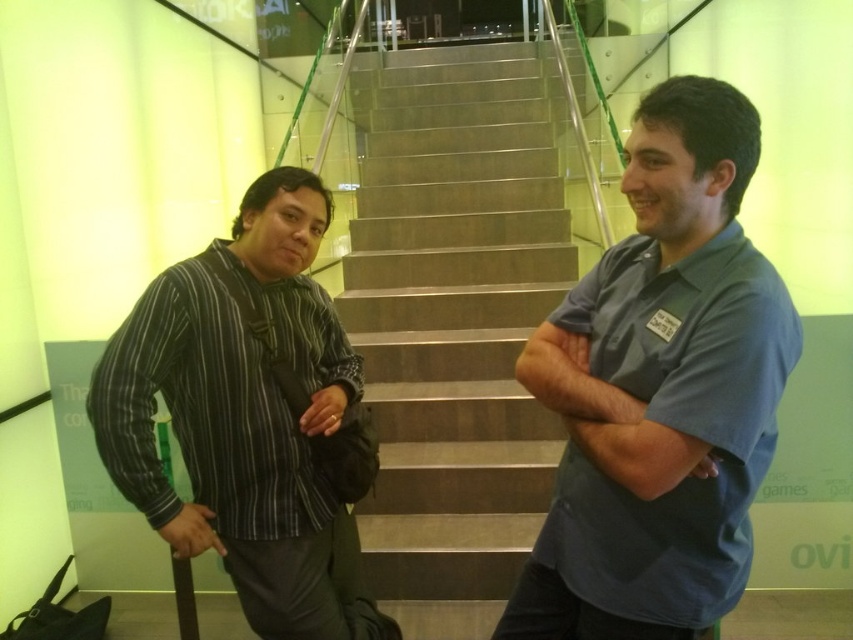
Is blue fabric shirt at center below striped cotton shirt at left?

No.

Is blue fabric shirt at center positioned at the back of striped cotton shirt at left?

No.

Where is `blue fabric shirt at center`? blue fabric shirt at center is located at coordinates (660, 390).

Image resolution: width=853 pixels, height=640 pixels. What are the coordinates of `blue fabric shirt at center` in the screenshot? It's located at (660, 390).

Can you confirm if blue fabric shirt at center is positioned above metallic staircase at center?

Answer: No, blue fabric shirt at center is not above metallic staircase at center.

Is point (695, 627) positioned before point (395, 420)?

That is True.

Describe the element at coordinates (660, 390) in the screenshot. I see `blue fabric shirt at center` at that location.

At what (x,y) coordinates should I click in order to perform the action: click on blue fabric shirt at center. Please return your answer as a coordinate pair (x, y). The image size is (853, 640). Looking at the image, I should click on (660, 390).

Is metallic staircase at center to the right of striped cotton shirt at left from the viewer's perspective?

Correct, you'll find metallic staircase at center to the right of striped cotton shirt at left.

Is metallic staircase at center behind striped cotton shirt at left?

Yes, metallic staircase at center is behind striped cotton shirt at left.

Identify the location of metallic staircase at center. (454, 328).